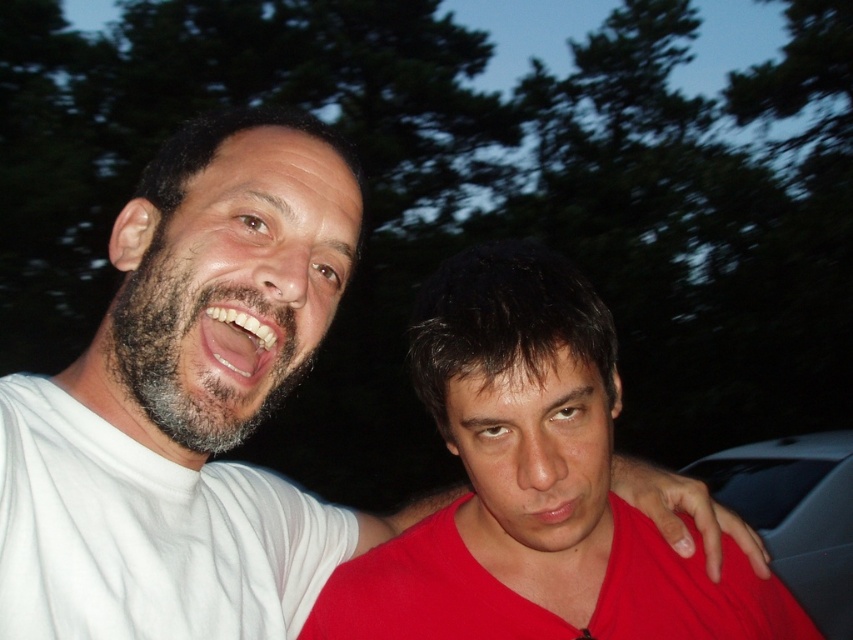
Who is higher up, matte red shirt at center or dark gray metallic car at right?

Positioned higher is matte red shirt at center.

Between matte red shirt at center and dark gray metallic car at right, which one appears on the right side from the viewer's perspective?

dark gray metallic car at right

Describe the element at coordinates (534, 486) in the screenshot. I see `matte red shirt at center` at that location.

Locate an element on the screen. matte red shirt at center is located at coordinates (534, 486).